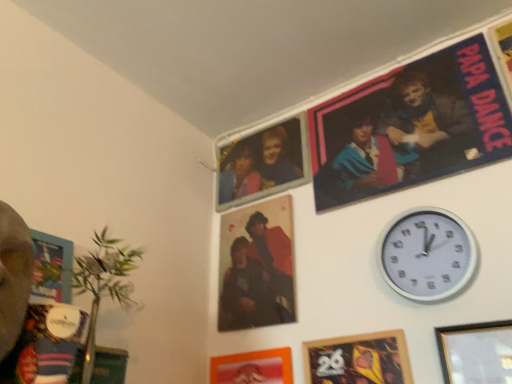
Question: Is matte blue fabric poster at upper right facing towards wooden framed poster at lower center, the second picture frame positioned from the left?

Choices:
 (A) yes
 (B) no

Answer: (B)

Question: Does matte blue fabric poster at upper right have a lesser width compared to wooden framed poster at lower center, acting as the second picture frame starting from the right?

Choices:
 (A) yes
 (B) no

Answer: (B)

Question: Is matte blue fabric poster at upper right smaller than wooden framed poster at lower center, the second picture frame positioned from the left?

Choices:
 (A) no
 (B) yes

Answer: (A)

Question: Is matte blue fabric poster at upper right to the right of wooden framed poster at lower center, the second picture frame positioned from the left, from the viewer's perspective?

Choices:
 (A) yes
 (B) no

Answer: (A)

Question: Is matte blue fabric poster at upper right directly adjacent to wooden framed poster at lower center, the second picture frame positioned from the left?

Choices:
 (A) no
 (B) yes

Answer: (A)

Question: Does point (229, 380) appear closer or farther from the camera than point (429, 261)?

Choices:
 (A) closer
 (B) farther

Answer: (B)

Question: Visually, is matte orange picture frame at lower center, arranged as the 3th picture frame when viewed from the right, positioned to the left or to the right of white plastic wall clock at upper right?

Choices:
 (A) left
 (B) right

Answer: (A)

Question: From a real-world perspective, is matte orange picture frame at lower center, the 1th picture frame positioned from the left, physically located above or below white plastic wall clock at upper right?

Choices:
 (A) below
 (B) above

Answer: (A)

Question: Choose the correct answer: Is matte orange picture frame at lower center, arranged as the 3th picture frame when viewed from the right, inside white plastic wall clock at upper right or outside it?

Choices:
 (A) outside
 (B) inside

Answer: (A)

Question: In the image, is wooden framed poster at lower center, acting as the second picture frame starting from the right, positioned in front of or behind wooden picture frame at lower right, placed as the 1th picture frame when sorted from right to left?

Choices:
 (A) front
 (B) behind

Answer: (B)

Question: Based on their positions, is wooden framed poster at lower center, the second picture frame positioned from the left, located to the left or right of wooden picture frame at lower right, placed as the 1th picture frame when sorted from right to left?

Choices:
 (A) right
 (B) left

Answer: (B)

Question: Considering the positions of point (360, 362) and point (464, 377), is point (360, 362) closer or farther from the camera than point (464, 377)?

Choices:
 (A) closer
 (B) farther

Answer: (B)

Question: Considering the positions of wooden framed poster at lower center, acting as the second picture frame starting from the right, and wooden picture frame at lower right, the third picture frame positioned from the left, in the image, is wooden framed poster at lower center, acting as the second picture frame starting from the right, wider or thinner than wooden picture frame at lower right, the third picture frame positioned from the left,?

Choices:
 (A) wide
 (B) thin

Answer: (A)

Question: From a real-world perspective, is wooden picture frame at lower right, the third picture frame positioned from the left, physically located above or below matte plastic photo frame at upper center?

Choices:
 (A) below
 (B) above

Answer: (A)

Question: From the image's perspective, is wooden picture frame at lower right, the third picture frame positioned from the left, positioned above or below matte plastic photo frame at upper center?

Choices:
 (A) above
 (B) below

Answer: (B)